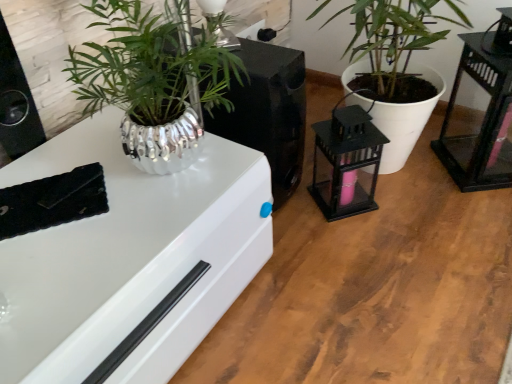
Where is `free space in front of white matte plant pot at center`? Image resolution: width=512 pixels, height=384 pixels. free space in front of white matte plant pot at center is located at coordinates (398, 248).